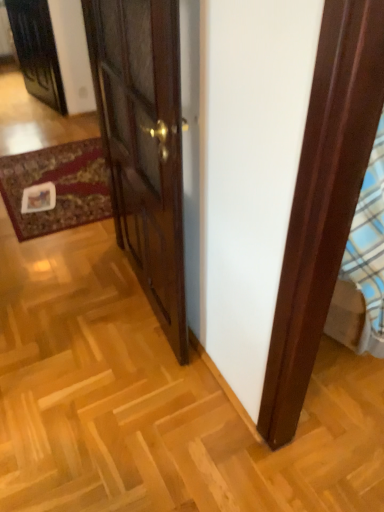
Identify the location of matte black cabinet at upper left. This screenshot has width=384, height=512. (36, 51).

The width and height of the screenshot is (384, 512). Describe the element at coordinates (36, 51) in the screenshot. I see `matte black cabinet at upper left` at that location.

Where is `matte black cabinet at upper left`? matte black cabinet at upper left is located at coordinates (36, 51).